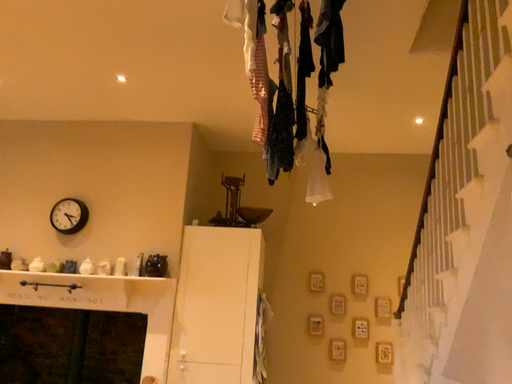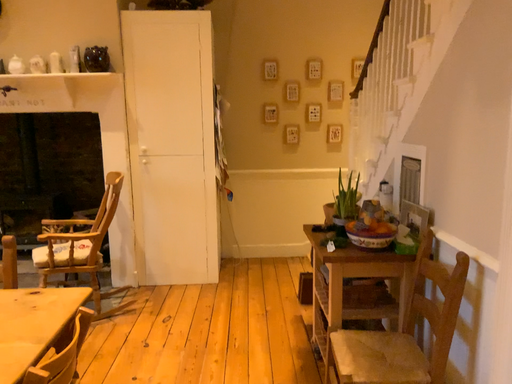
Question: Which way did the camera rotate in the video?

Choices:
 (A) rotated left
 (B) rotated right

Answer: (B)